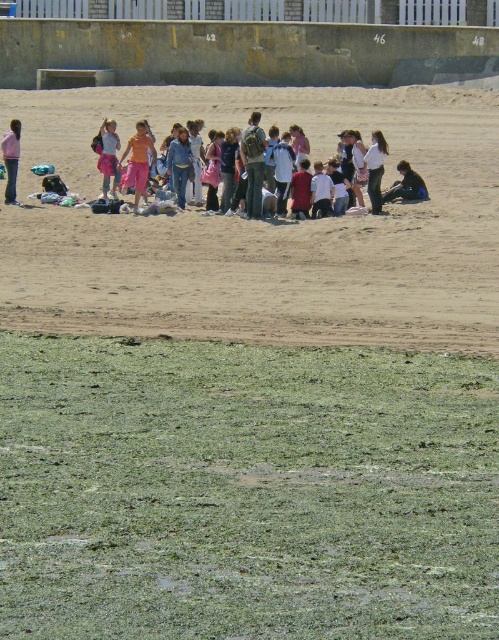
Question: Does brown sandy beach at center appear under white matte shirt at center?

Choices:
 (A) no
 (B) yes

Answer: (B)

Question: Among these objects, which one is farthest from the camera?

Choices:
 (A) matte orange tank top at center
 (B) brown sandy beach at center

Answer: (A)

Question: Can you confirm if brown sandy beach at center is bigger than matte pink shirt at left?

Choices:
 (A) yes
 (B) no

Answer: (A)

Question: Which object is closer to the camera taking this photo?

Choices:
 (A) brown sandy beach at center
 (B) white matte shirt at center
 (C) matte pink shirt at left

Answer: (A)

Question: Is matte orange tank top at center positioned before matte pink shirt at left?

Choices:
 (A) no
 (B) yes

Answer: (B)

Question: Which point appears farthest from the camera in this image?

Choices:
 (A) (413, 184)
 (B) (108, 144)

Answer: (B)